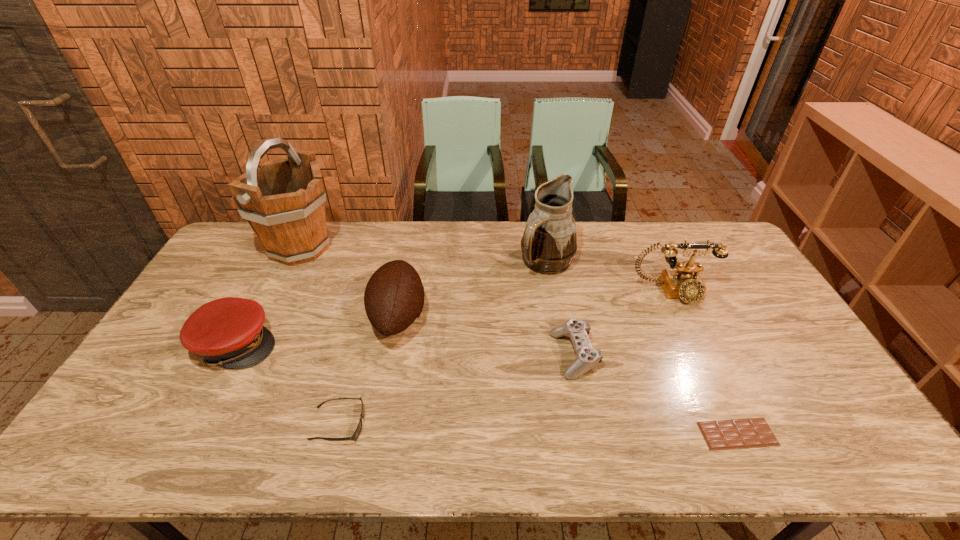
Where is `vacant space located 0.100m on the dial number of the telephone`? The height and width of the screenshot is (540, 960). vacant space located 0.100m on the dial number of the telephone is located at coordinates (690, 331).

What are the coordinates of `vacant space located 0.330m on the laces of the football` in the screenshot? It's located at (533, 316).

Where is `vacant space located 0.050m on the front of the cap with an emblem`? vacant space located 0.050m on the front of the cap with an emblem is located at coordinates pyautogui.click(x=294, y=344).

Where is `free space located on the back of the sixth tallest object`? Image resolution: width=960 pixels, height=540 pixels. free space located on the back of the sixth tallest object is located at coordinates (564, 300).

At what (x,y) coordinates should I click in order to perform the action: click on vacant space located on the front-facing side of the second shortest object. Please return your answer as a coordinate pair (x, y). Looking at the image, I should click on (497, 424).

You are a GUI agent. You are given a task and a screenshot of the screen. Output one action in this format:
    pyautogui.click(x=<x>, y=<y>)
    Task: Click on the free space located 0.310m on the left of the shortest object
    
    Given the screenshot: What is the action you would take?
    pyautogui.click(x=573, y=434)

This screenshot has height=540, width=960. In order to click on bucket that is at the far edge in this screenshot , I will do `click(283, 200)`.

You are a GUI agent. You are given a task and a screenshot of the screen. Output one action in this format:
    pyautogui.click(x=<x>, y=<y>)
    Task: Click on the pitcher positioned at the far edge
    
    Given the screenshot: What is the action you would take?
    pyautogui.click(x=549, y=243)

The image size is (960, 540). In order to click on sunglasses present at the near edge in this screenshot , I will do `click(354, 437)`.

Locate an element on the screen. The width and height of the screenshot is (960, 540). chocolate bar present at the near edge is located at coordinates (753, 432).